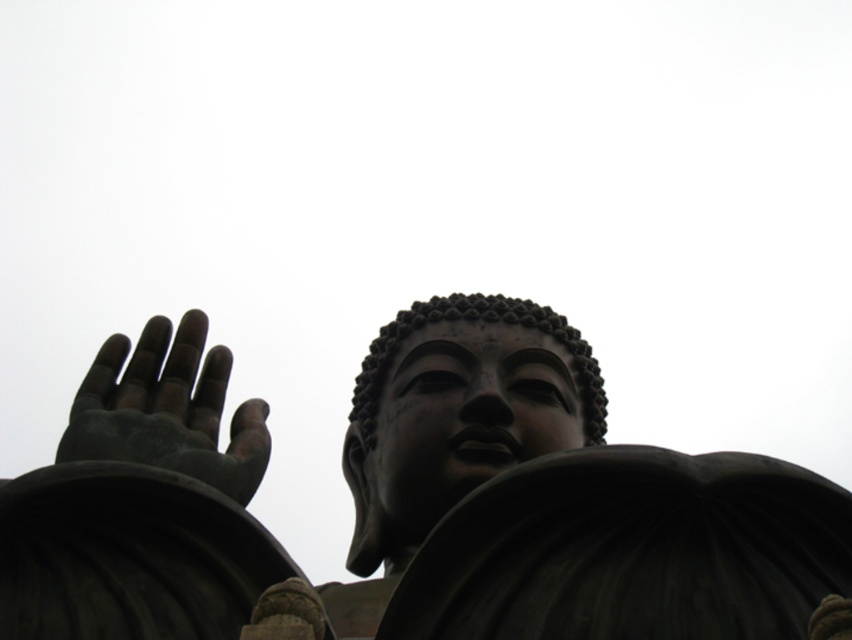
Question: Is black polished statue at center below matte black statue at center?

Choices:
 (A) yes
 (B) no

Answer: (A)

Question: Which point is farther from the camera taking this photo?

Choices:
 (A) (164, 394)
 (B) (390, 477)
 (C) (763, 612)

Answer: (B)

Question: Which of these objects is positioned closest to the matte black statue at center?

Choices:
 (A) black polished statue at center
 (B) matte bronze hand at lower left

Answer: (A)

Question: Which point is closer to the camera?

Choices:
 (A) (371, 522)
 (B) (795, 552)
 (C) (125, 387)

Answer: (B)

Question: Can you confirm if matte black statue at center is positioned to the right of matte bronze hand at lower left?

Choices:
 (A) no
 (B) yes

Answer: (B)

Question: Can you confirm if black polished statue at center is positioned to the left of matte bronze hand at lower left?

Choices:
 (A) yes
 (B) no

Answer: (B)